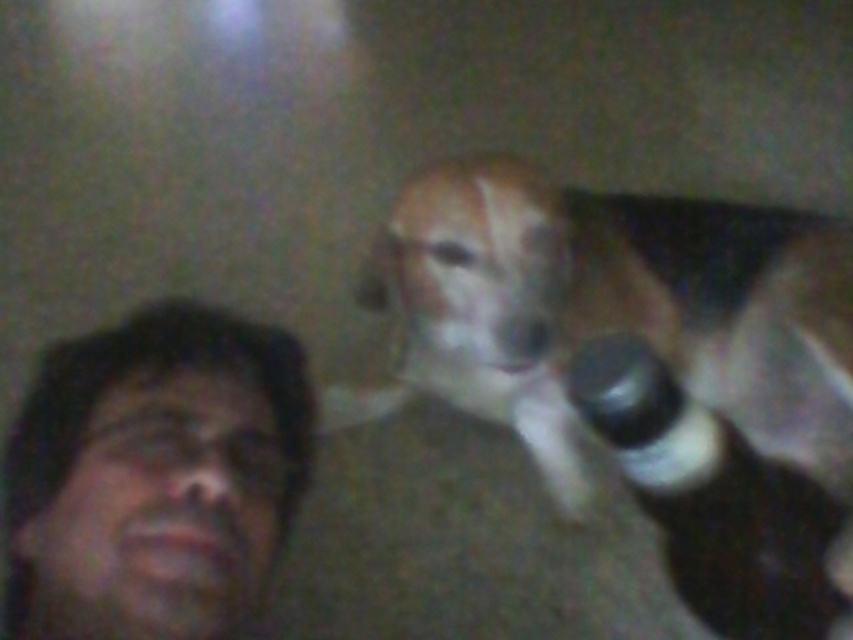
You are a photographer trying to capture a clear shot of both the brown fur dog at upper right and the matte black hair at left. Based on the scene description, which subject is positioned higher in the frame?

The brown fur dog at upper right is located above matte black hair at left, so the brown fur dog at upper right is positioned higher in the frame.

You are a photographer who wants to ensure both the brown fur dog at upper right and the matte black hair at left are clearly visible in the photo. Given the current lighting conditions, which subject might be harder to capture clearly and why?

The matte black hair at left might be harder to capture clearly because it is smaller in size compared to the brown fur dog at upper right, making it more challenging to focus on in low light or motion blur conditions.